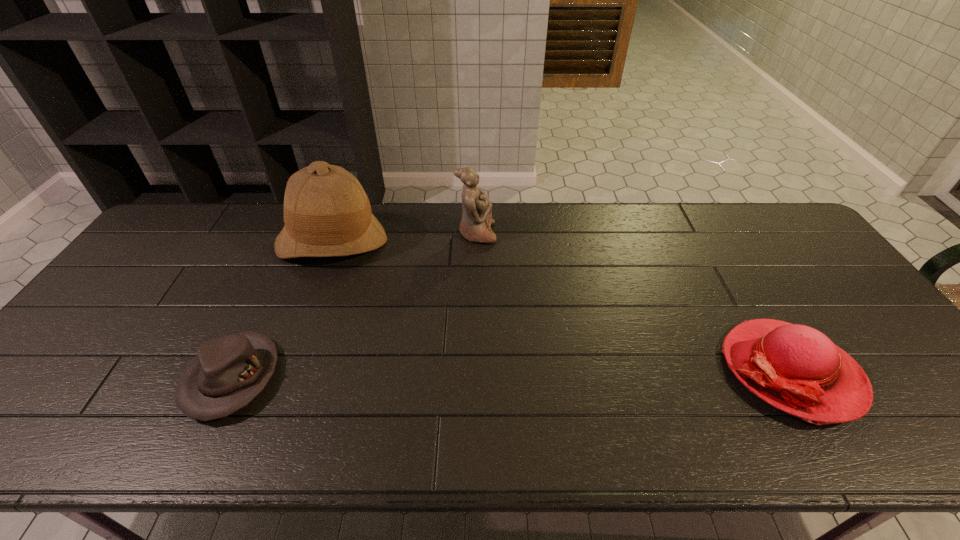
Identify the location of free space between the second shortest object and the shortest object. The height and width of the screenshot is (540, 960). (512, 374).

Locate which object is the third closest to the tallest hat. Please provide its 2D coordinates. Your answer should be formatted as a tuple, i.e. [(x, y)], where the tuple contains the x and y coordinates of a point satisfying the conditions above.

[(797, 369)]

You are a GUI agent. You are given a task and a screenshot of the screen. Output one action in this format:
    pyautogui.click(x=<x>, y=<y>)
    Task: Click on the object that is the second closest to the third shortest object
    
    Given the screenshot: What is the action you would take?
    pyautogui.click(x=229, y=371)

Where is `hat that is the second closest to the shortest hat`? This screenshot has height=540, width=960. hat that is the second closest to the shortest hat is located at coordinates (797, 369).

You are a GUI agent. You are given a task and a screenshot of the screen. Output one action in this format:
    pyautogui.click(x=<x>, y=<y>)
    Task: Click on the hat that is the closest to the rightmost hat
    Image resolution: width=960 pixels, height=540 pixels.
    Given the screenshot: What is the action you would take?
    pyautogui.click(x=327, y=213)

Image resolution: width=960 pixels, height=540 pixels. I want to click on vacant space that satisfies the following two spatial constraints: 1. at the front of the third tallest object with a bow; 2. on the decorative side of the shortest hat, so click(795, 377).

The image size is (960, 540). What are the coordinates of `vacant space that satisfies the following two spatial constraints: 1. on the front-facing side of the second object from right to left; 2. on the front-facing side of the farthest hat` in the screenshot? It's located at (476, 241).